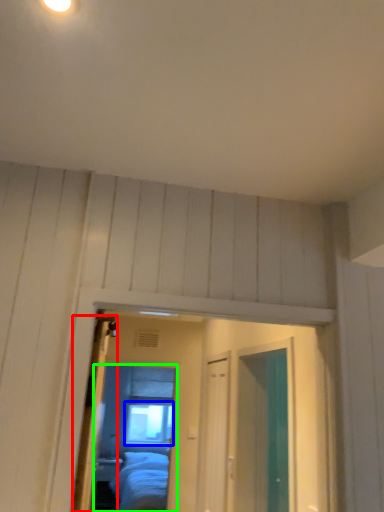
Question: Estimate the real-world distances between objects in this image. Which object is farther from door (highlighted by a red box), window (highlighted by a blue box) or mirror (highlighted by a green box)?

Choices:
 (A) window
 (B) mirror

Answer: (A)